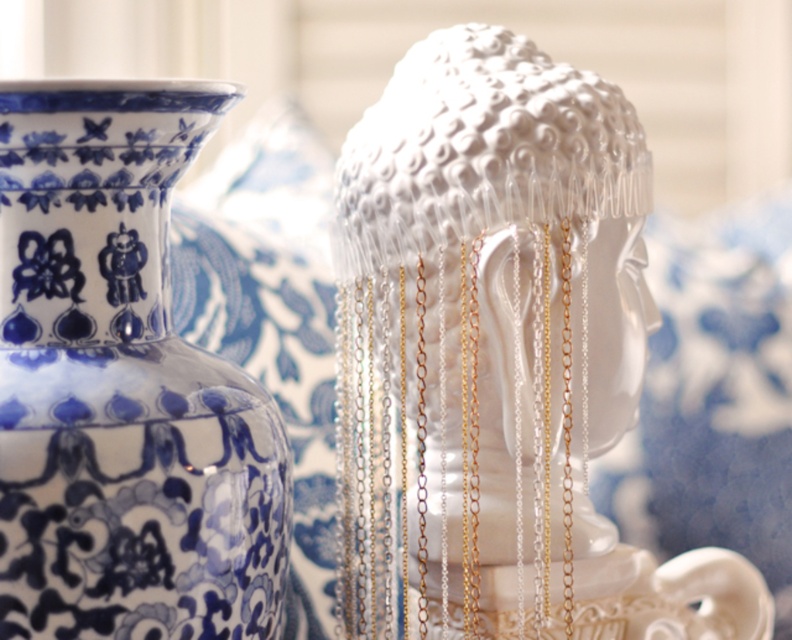
Looking at the image, where is the white glossy headpiece at center in relation to the blue porcelain vase at upper left?

The white glossy headpiece at center is located to the right of the blue porcelain vase at upper left.

You are an art curator arranging an exhibition. You have to place the white glossy headpiece at center and the blue porcelain vase at upper left in a display case. Given that the headpiece is larger, which object should be placed in the central focal point of the case to emphasize its size?

The white glossy headpiece at center should be placed in the central focal point of the case because it is bigger than the blue porcelain vase at upper left, making it the more prominent piece to highlight.

You are an interior designer assessing the placement of the white glossy headpiece at center and the blue porcelain vase at upper left. Based on their sizes, which object would be more suitable to place on a high shelf to avoid blocking the view of the other?

The white glossy headpiece at center is taller than the blue porcelain vase at upper left. Placing the taller headpiece on a high shelf would prevent it from obstructing the view of the shorter vase below.